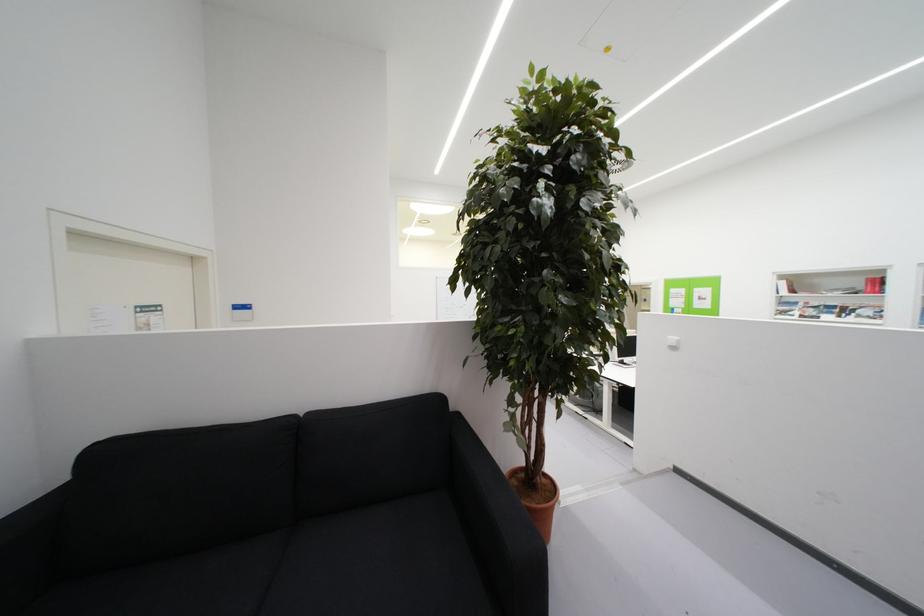
The width and height of the screenshot is (924, 616). In order to click on black sofa sitting surface in this screenshot , I will do `click(305, 570)`.